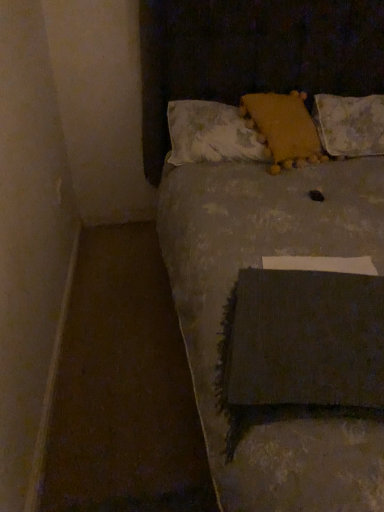
Question: Is white textured pillow at upper right, which is the third pillow in left-to-right order, bigger or smaller than fluffy white pillow at upper center, which ranks as the third pillow in right-to-left order?

Choices:
 (A) small
 (B) big

Answer: (A)

Question: Is white textured pillow at upper right, the first pillow from the right, in front of or behind fluffy white pillow at upper center, which ranks as the third pillow in right-to-left order, in the image?

Choices:
 (A) behind
 (B) front

Answer: (A)

Question: Which object is the closest to the fluffy white pillow at upper center, which ranks as the third pillow in right-to-left order?

Choices:
 (A) white textured pillow at upper right, the first pillow from the right
 (B) yellow fuzzy pillow at upper center, acting as the second pillow starting from the right
 (C) textured gray blanket at center

Answer: (B)

Question: Which object is the closest to the white textured pillow at upper right, which is the third pillow in left-to-right order?

Choices:
 (A) textured gray blanket at center
 (B) fluffy white pillow at upper center, which ranks as the third pillow in right-to-left order
 (C) yellow fuzzy pillow at upper center, the second pillow when ordered from left to right

Answer: (C)